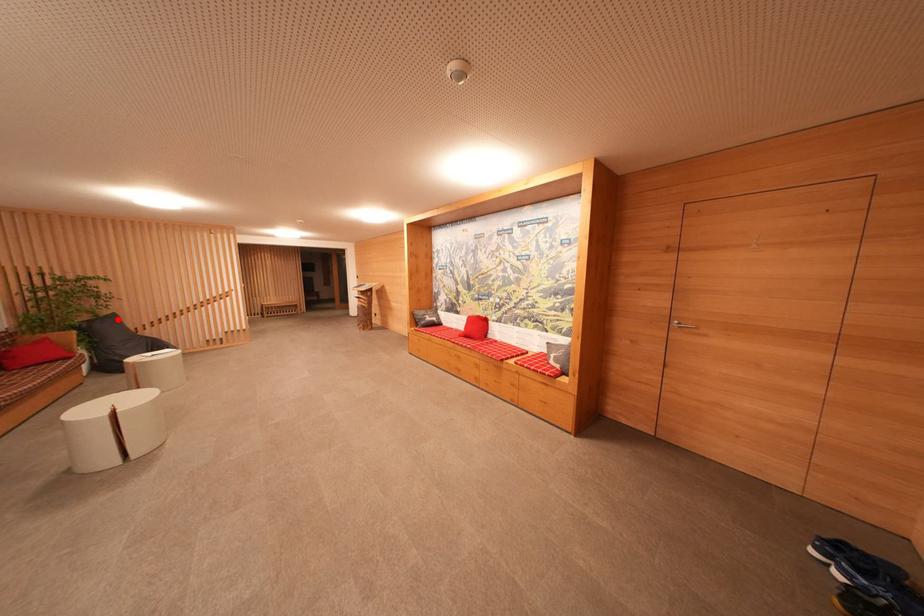
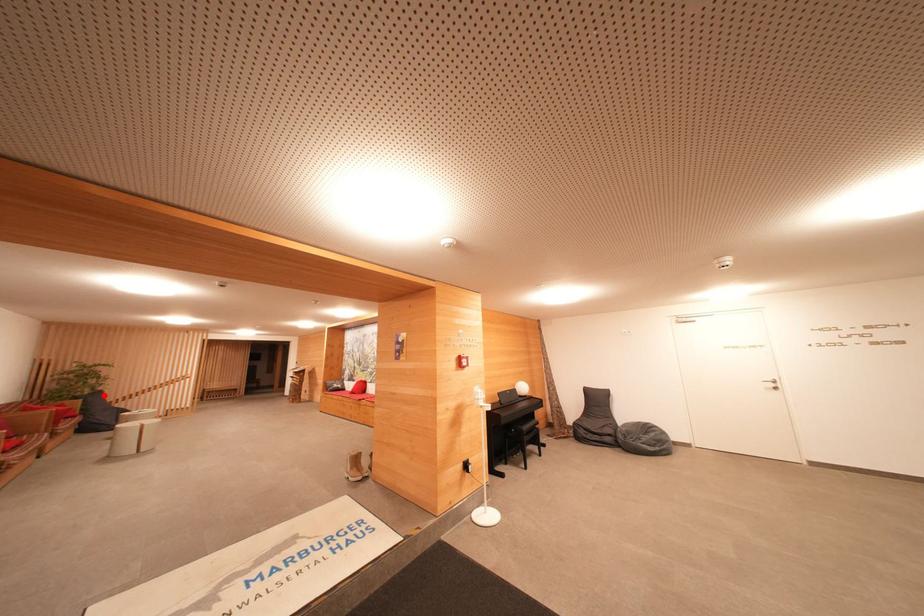
I am providing you with two images of the same scene from different viewpoints. A red point is marked on the first image and another point is marked on the second image. Are the points marked in image1 and image2 representing the same 3D position?

Yes